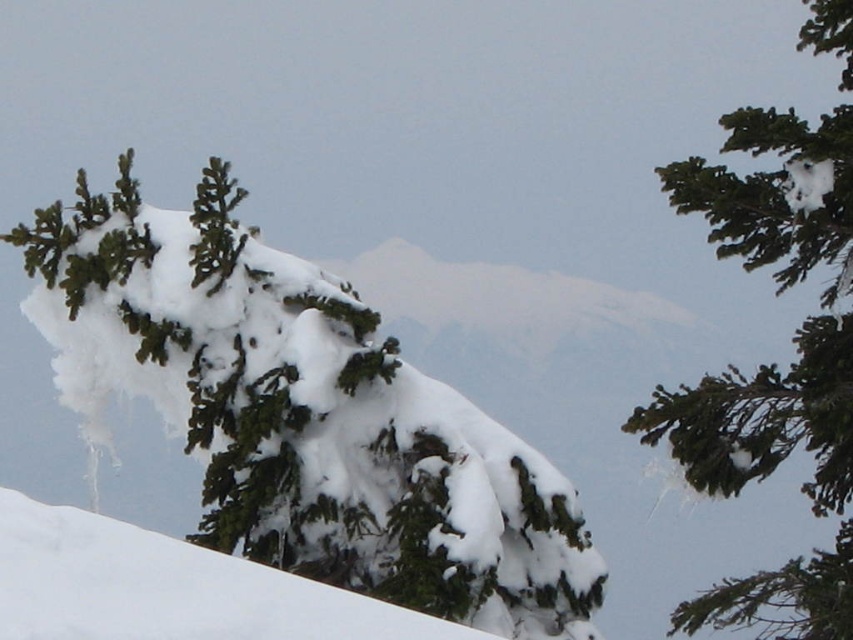
Question: Which point is closer to the camera?

Choices:
 (A) white snow at center
 (B) green matte evergreen tree at upper center
 (C) green matte tree branch at upper right

Answer: (A)

Question: Which point appears closest to the camera in this image?

Choices:
 (A) (78, 566)
 (B) (778, 589)
 (C) (175, 234)

Answer: (A)

Question: Is the position of green matte evergreen tree at upper center less distant than that of white snow at center?

Choices:
 (A) no
 (B) yes

Answer: (A)

Question: Does green matte evergreen tree at upper center appear over white snow at center?

Choices:
 (A) no
 (B) yes

Answer: (B)

Question: Does green matte tree branch at upper right have a greater width compared to white snow at center?

Choices:
 (A) no
 (B) yes

Answer: (A)

Question: Which object is farther from the camera taking this photo?

Choices:
 (A) green matte tree branch at upper right
 (B) green matte evergreen tree at upper center
 (C) white snow at center

Answer: (A)